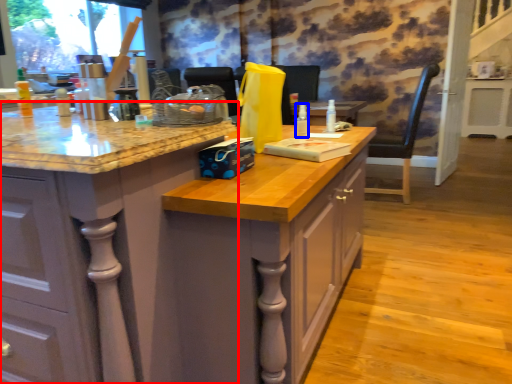
Question: Which object is further to the camera taking this photo, cabinetry (highlighted by a red box) or bottle (highlighted by a blue box)?

Choices:
 (A) cabinetry
 (B) bottle

Answer: (B)